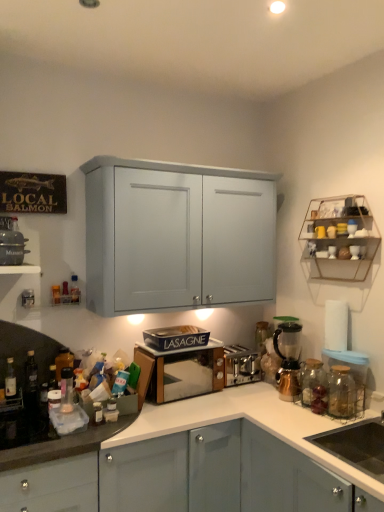
Question: Is translucent plastic bottle at center, which appears as the second bottle when viewed from the right, behind black matte sink at lower right?

Choices:
 (A) yes
 (B) no

Answer: (A)

Question: Does translucent plastic bottle at center, which is the 1th bottle in back-to-front order, have a lesser height compared to black matte sink at lower right?

Choices:
 (A) no
 (B) yes

Answer: (B)

Question: Considering the relative sizes of translucent plastic bottle at center, which is the 1th bottle in back-to-front order, and black matte sink at lower right in the image provided, is translucent plastic bottle at center, which is the 1th bottle in back-to-front order, wider than black matte sink at lower right?

Choices:
 (A) no
 (B) yes

Answer: (A)

Question: Can you confirm if translucent plastic bottle at center, which appears as the second bottle when viewed from the right, is bigger than black matte sink at lower right?

Choices:
 (A) yes
 (B) no

Answer: (B)

Question: From a real-world perspective, is translucent plastic bottle at center, the 4th bottle when ordered from left to right, on black matte sink at lower right?

Choices:
 (A) no
 (B) yes

Answer: (B)

Question: Based on their sizes in the image, would you say translucent plastic bottle at left, arranged as the first bottle when viewed from the left, is bigger or smaller than satin silver toaster at center, arranged as the 3th appliance when viewed from the left?

Choices:
 (A) big
 (B) small

Answer: (B)

Question: From the image's perspective, is translucent plastic bottle at left, which ranks as the third bottle in front-to-back order, located above or below satin silver toaster at center, positioned as the first appliance in bottom-to-top order?

Choices:
 (A) below
 (B) above

Answer: (B)

Question: Considering the positions of translucent plastic bottle at left, which ranks as the third bottle in front-to-back order, and satin silver toaster at center, which appears as the first appliance when viewed from the back, in the image, is translucent plastic bottle at left, which ranks as the third bottle in front-to-back order, taller or shorter than satin silver toaster at center, which appears as the first appliance when viewed from the back,?

Choices:
 (A) short
 (B) tall

Answer: (B)

Question: From a real-world perspective, is translucent plastic bottle at left, arranged as the first bottle when viewed from the left, positioned above or below satin silver toaster at center, which ranks as the 3th appliance in front-to-back order?

Choices:
 (A) below
 (B) above

Answer: (B)

Question: From their relative heights in the image, would you say translucent plastic bottle at left, which is counted as the 2th bottle, starting from the back, is taller or shorter than metallic wire rack at upper right?

Choices:
 (A) tall
 (B) short

Answer: (B)

Question: Considering their positions, is translucent plastic bottle at left, which ranks as the 3th bottle in left-to-right order, located in front of or behind metallic wire rack at upper right?

Choices:
 (A) front
 (B) behind

Answer: (B)

Question: Is point (71, 359) positioned closer to the camera than point (357, 242)?

Choices:
 (A) closer
 (B) farther

Answer: (A)

Question: Which is correct: translucent plastic bottle at left, which ranks as the 3th bottle in left-to-right order, is inside metallic wire rack at upper right, or outside of it?

Choices:
 (A) inside
 (B) outside

Answer: (B)

Question: In the image, is metallic copper coffee machine at right on the left side or the right side of translucent plastic bottle at left, which ranks as the third bottle in front-to-back order?

Choices:
 (A) left
 (B) right

Answer: (B)

Question: From their relative heights in the image, would you say metallic copper coffee machine at right is taller or shorter than translucent plastic bottle at left, positioned as the 5th bottle in right-to-left order?

Choices:
 (A) short
 (B) tall

Answer: (B)